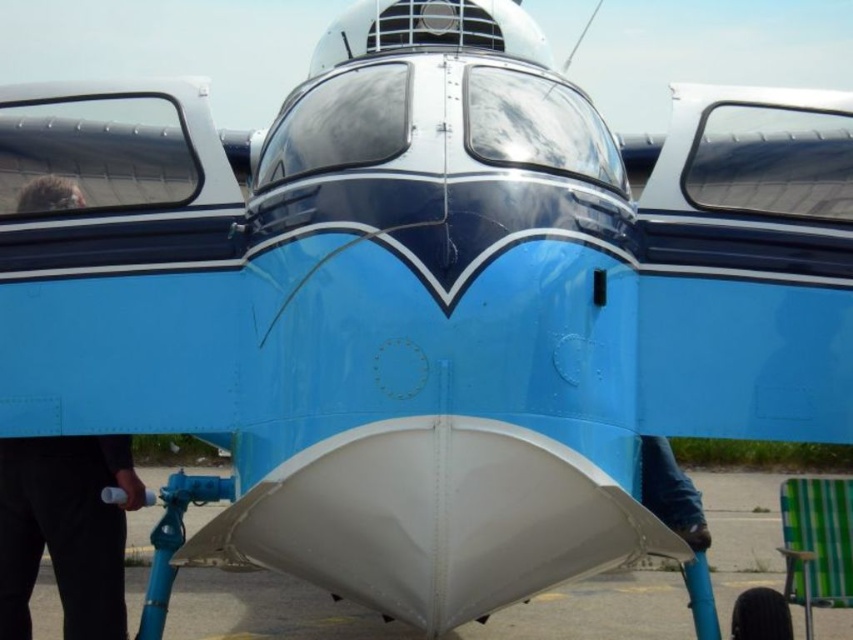
Based on the photo, between white matte tarmac at center and black matte hair at left, which one is positioned higher?

black matte hair at left

Is white matte tarmac at center below black matte hair at left?

Indeed, white matte tarmac at center is positioned under black matte hair at left.

What do you see at coordinates (265, 611) in the screenshot?
I see `white matte tarmac at center` at bounding box center [265, 611].

This screenshot has width=853, height=640. I want to click on white matte tarmac at center, so click(x=265, y=611).

Between black matte hair at left and green checkered chair at lower right, which one is positioned higher?

Positioned higher is black matte hair at left.

Can you confirm if black matte hair at left is positioned to the left of green checkered chair at lower right?

Yes, black matte hair at left is to the left of green checkered chair at lower right.

You are a GUI agent. You are given a task and a screenshot of the screen. Output one action in this format:
    pyautogui.click(x=<x>, y=<y>)
    Task: Click on the black matte hair at left
    The width and height of the screenshot is (853, 640).
    Given the screenshot: What is the action you would take?
    pyautogui.click(x=65, y=531)

Can you confirm if white matte tarmac at center is positioned below green checkered chair at lower right?

Yes.

The width and height of the screenshot is (853, 640). Identify the location of white matte tarmac at center. (265, 611).